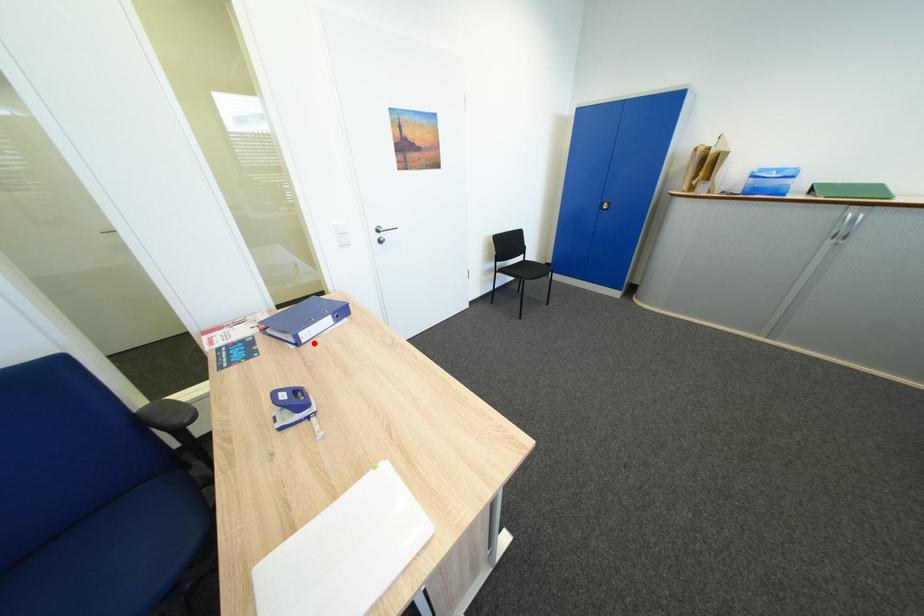
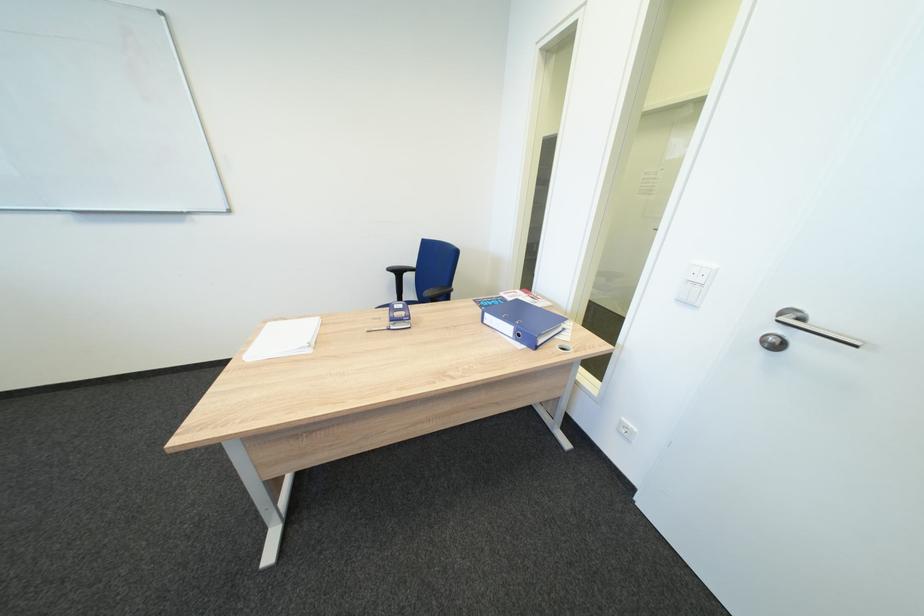
Find the pixel in the second image that matches the highlighted location in the first image.

(495, 323)